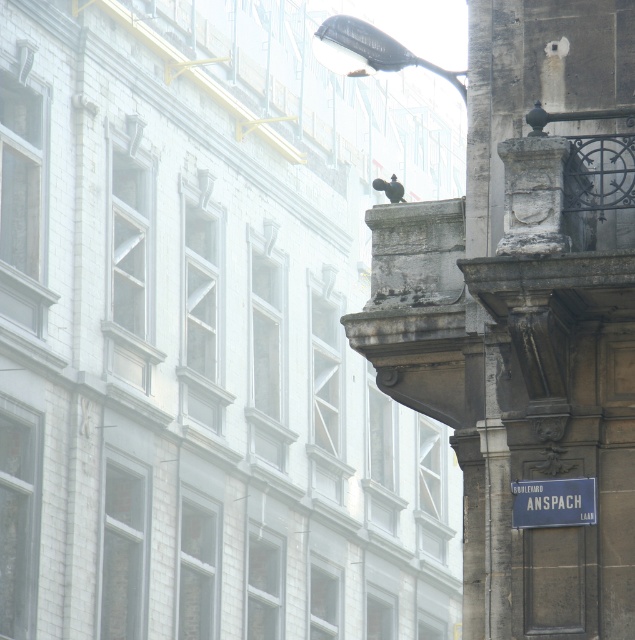
Question: Can you confirm if black glass streetlight at upper center is thinner than blue metallic street sign at lower right?

Choices:
 (A) yes
 (B) no

Answer: (B)

Question: Which object is farther from the camera taking this photo?

Choices:
 (A) blue metallic street sign at lower right
 (B) black glass streetlight at upper center

Answer: (B)

Question: Does black glass streetlight at upper center appear on the right side of blue metallic street sign at lower right?

Choices:
 (A) no
 (B) yes

Answer: (A)

Question: From the image, what is the correct spatial relationship of black glass streetlight at upper center in relation to blue metallic street sign at lower right?

Choices:
 (A) below
 (B) above

Answer: (B)

Question: Which point is closer to the camera taking this photo?

Choices:
 (A) (547, 513)
 (B) (345, 35)

Answer: (A)